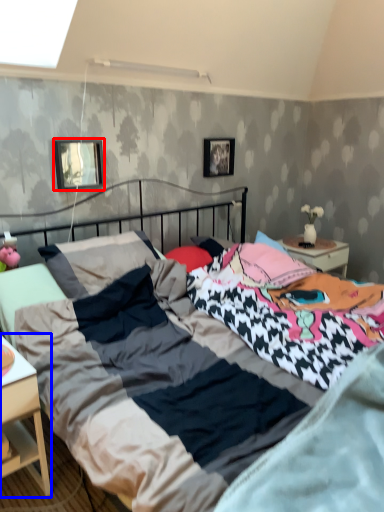
Question: Which object is closer to the camera taking this photo, picture frame (highlighted by a red box) or nightstand (highlighted by a blue box)?

Choices:
 (A) picture frame
 (B) nightstand

Answer: (B)